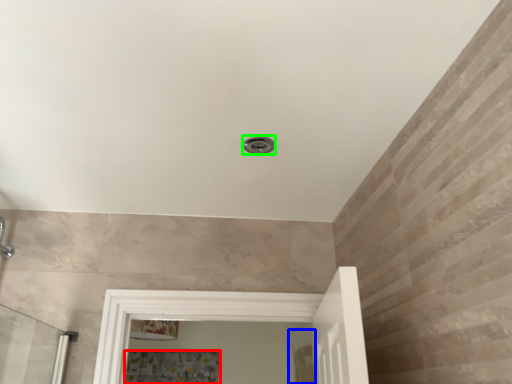
Question: Based on their relative distances, which object is farther from shower curtain (highlighted by a red box)? Choose from screen door (highlighted by a blue box) and shower (highlighted by a green box).

Choices:
 (A) screen door
 (B) shower

Answer: (B)